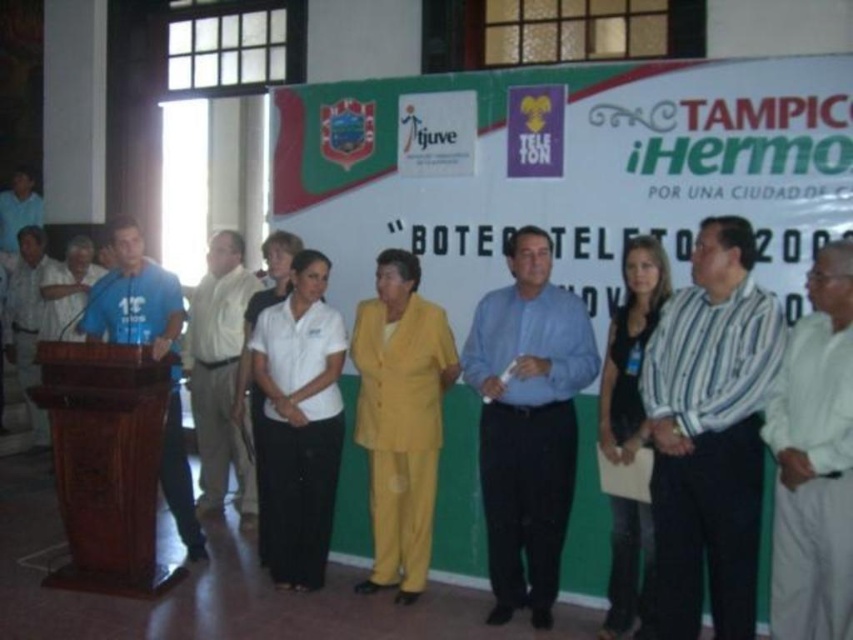
You are attending a formal event and need to position yourself between the brown polished wood podium at left and the white smooth shirt at center. Which object should you stand closer to if you want to be equidistant from both?

To be equidistant from both the brown polished wood podium at left and the white smooth shirt at center, you should stand closer to the white smooth shirt at center since the podium is wider than the shirt, as stated in the description.

You are a photographer at this event. You need to capture a photo where both the striped cotton shirt at right and the blue shirt at center are visible. Based on their positions, which shirt should you focus on to ensure both are in the frame?

The striped cotton shirt at right is positioned over the blue shirt at center, so focusing on the striped cotton shirt at right will ensure both are visible in the photo.